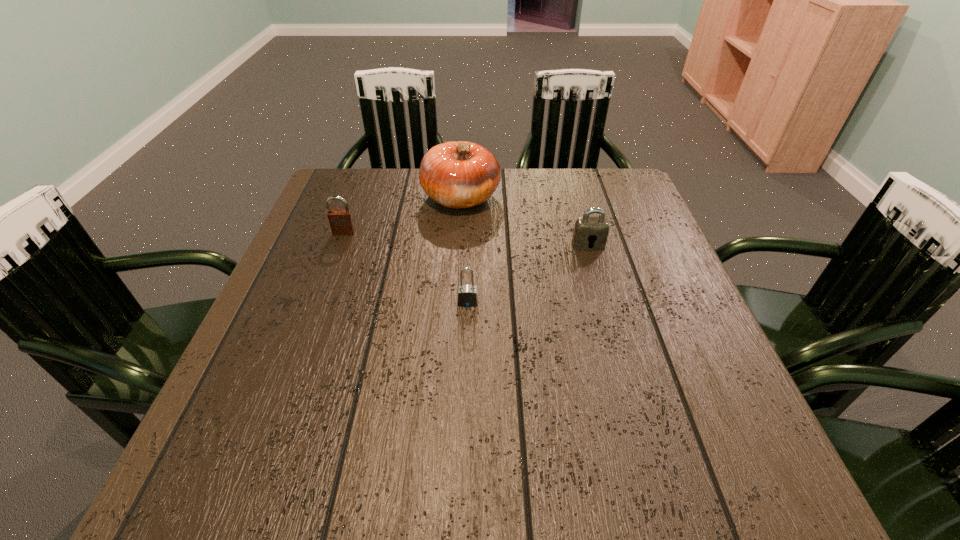
The width and height of the screenshot is (960, 540). In order to click on vacant region between the second padlock from right to left and the rightmost object in this screenshot , I will do `click(528, 274)`.

Image resolution: width=960 pixels, height=540 pixels. What are the coordinates of `free space between the second padlock from right to left and the rightmost padlock` in the screenshot? It's located at click(528, 274).

Identify which object is the nearest to the tallest object. Please provide its 2D coordinates. Your answer should be formatted as a tuple, i.e. [(x, y)], where the tuple contains the x and y coordinates of a point satisfying the conditions above.

[(341, 222)]

Where is `object that is the closest to the leftmost object`? object that is the closest to the leftmost object is located at coordinates (459, 174).

Identify the location of padlock that is the second closest to the leftmost object. This screenshot has height=540, width=960. (590, 233).

Locate an element on the screen. padlock identified as the closest to the nearest padlock is located at coordinates (590, 233).